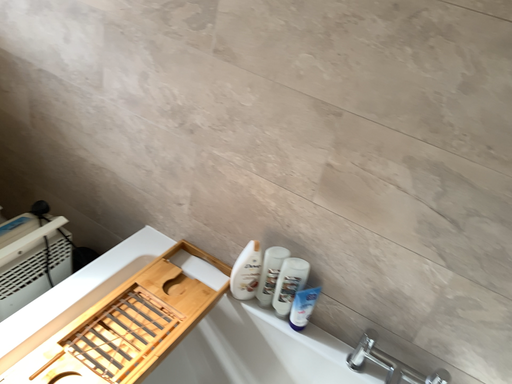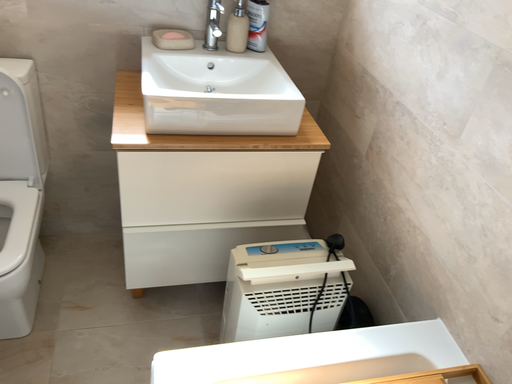
Question: How did the camera likely rotate when shooting the video?

Choices:
 (A) rotated right
 (B) rotated left

Answer: (B)